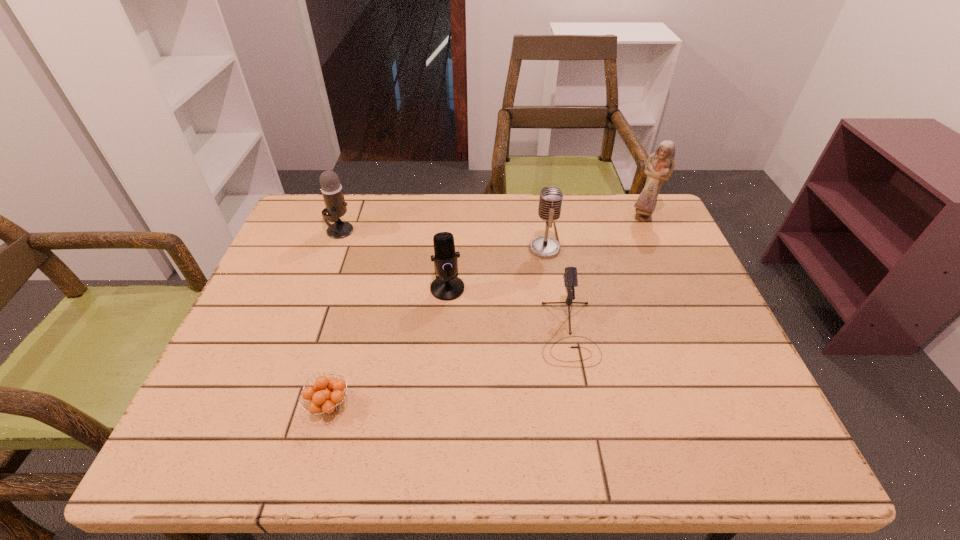
Locate an element on the screen. The width and height of the screenshot is (960, 540). free space at the near edge of the desktop is located at coordinates (619, 435).

Find the location of a particular element. The image size is (960, 540). vacant space at the left edge is located at coordinates (240, 402).

Find the location of a particular element. This screenshot has width=960, height=540. vacant space at the right edge of the desktop is located at coordinates (693, 298).

At what (x,y) coordinates should I click in order to perform the action: click on free location at the far left corner of the desktop. Please return your answer as a coordinate pair (x, y). The width and height of the screenshot is (960, 540). Looking at the image, I should click on (315, 212).

In the image, there is a desktop. Find the location of `vacant space at the far right corner`. vacant space at the far right corner is located at coordinates (668, 221).

The height and width of the screenshot is (540, 960). In the image, there is a desktop. In order to click on vacant space at the near right corner in this screenshot , I will do `click(702, 440)`.

I want to click on empty space that is in between the shortest object and the fifth tallest object, so click(x=448, y=369).

The width and height of the screenshot is (960, 540). In order to click on free space between the nearest object and the second shortest object in this screenshot , I will do `click(448, 369)`.

Find the location of a particular element. vacant region between the rightmost object and the shortest object is located at coordinates (486, 311).

Image resolution: width=960 pixels, height=540 pixels. In order to click on empty space between the leftmost microphone and the rightmost object in this screenshot , I will do `click(492, 224)`.